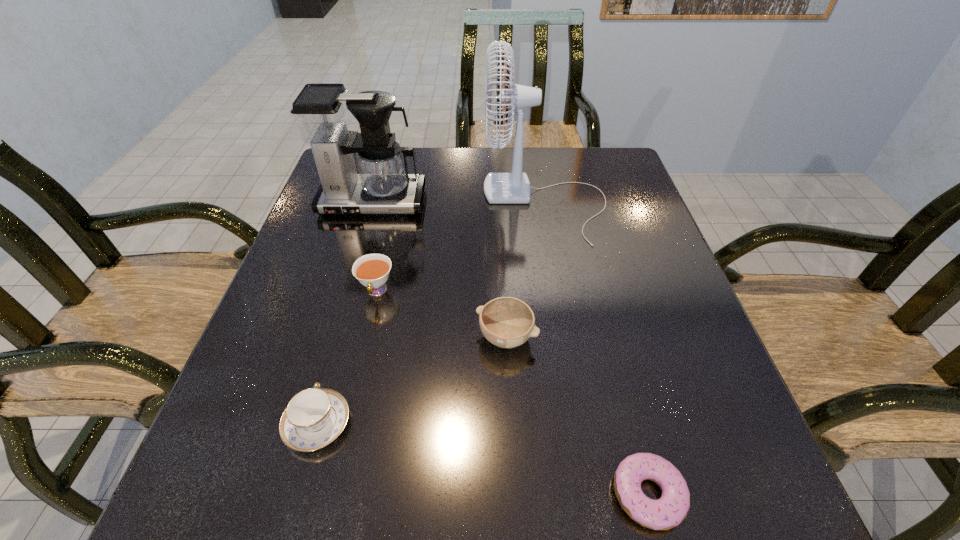
Locate an element on the screen. vacant space at the near edge of the desktop is located at coordinates (354, 496).

Locate an element on the screen. Image resolution: width=960 pixels, height=540 pixels. free spot at the left edge of the desktop is located at coordinates [x=298, y=305].

Find the location of a particular element. vacant space at the right edge is located at coordinates (636, 343).

At what (x,y) coordinates should I click in order to perform the action: click on vacant space at the near left corner. Please return your answer as a coordinate pair (x, y). The image size is (960, 540). Looking at the image, I should click on (307, 470).

The image size is (960, 540). What are the coordinates of `vacant space at the far right corner of the desktop` in the screenshot? It's located at (589, 162).

Locate an element on the screen. free space between the fifth farthest object and the second tallest object is located at coordinates (345, 313).

You are a GUI agent. You are given a task and a screenshot of the screen. Output one action in this format:
    pyautogui.click(x=<x>, y=<y>)
    Task: Click on the empty space between the nearest object and the shorter teacup
    The width and height of the screenshot is (960, 540).
    Given the screenshot: What is the action you would take?
    pyautogui.click(x=483, y=459)

The width and height of the screenshot is (960, 540). I want to click on empty space that is in between the taller teacup and the bowl, so click(x=442, y=314).

This screenshot has height=540, width=960. In order to click on empty location between the third farthest object and the tallest object in this screenshot , I will do `click(461, 247)`.

In order to click on vacant area that lies between the shortest object and the third nearest object in this screenshot , I will do click(577, 415).